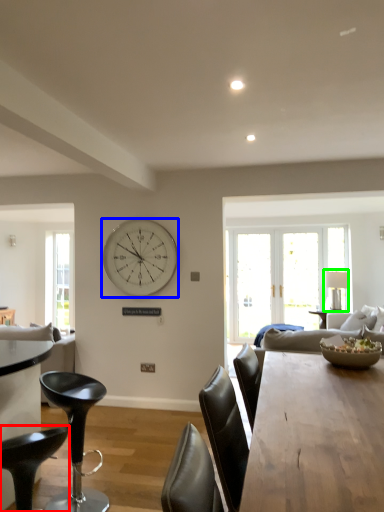
Question: Based on their relative distances, which object is nearer to chair (highlighted by a red box)? Choose from wall clock (highlighted by a blue box) and lamp (highlighted by a green box).

Choices:
 (A) wall clock
 (B) lamp

Answer: (A)